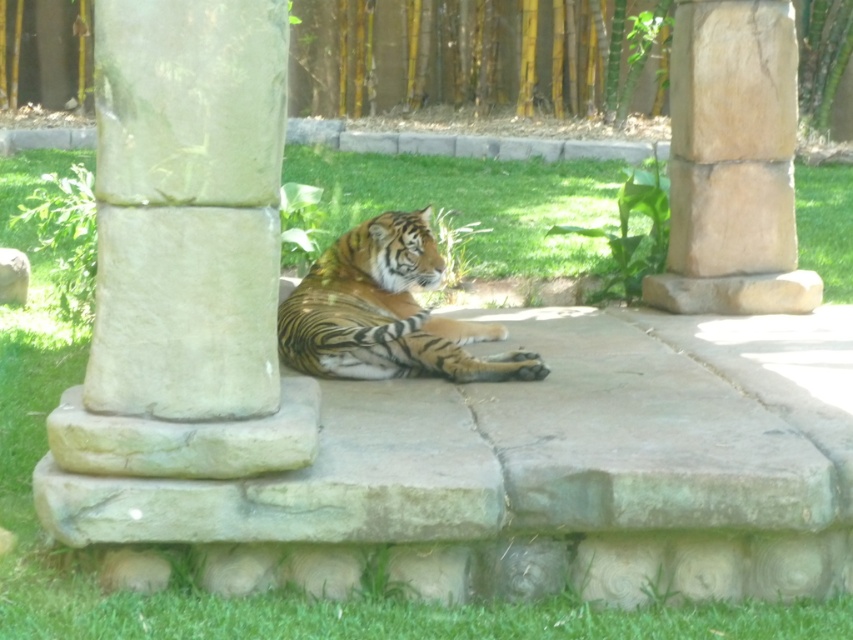
Can you confirm if smooth stone pillar at center is wider than natural stone pillar at center?

Incorrect, smooth stone pillar at center's width does not surpass natural stone pillar at center's.

Is smooth stone pillar at center positioned at the back of natural stone pillar at center?

No.

What are the coordinates of `smooth stone pillar at center` in the screenshot? It's located at (187, 208).

Between smooth stone pillar at center and smooth beige stone at lower left, which one has less height?

smooth beige stone at lower left is shorter.

The image size is (853, 640). Find the location of `smooth stone pillar at center`. smooth stone pillar at center is located at coordinates (187, 208).

Locate an element on the screen. The image size is (853, 640). smooth stone pillar at center is located at coordinates (187, 208).

Is smooth stone pillar at center positioned before orange-yellow tiger at center?

Yes, smooth stone pillar at center is in front of orange-yellow tiger at center.

Is point (219, 326) closer to camera compared to point (340, 371)?

Yes, point (219, 326) is closer to viewer.

Where is `smooth stone pillar at center`? The height and width of the screenshot is (640, 853). smooth stone pillar at center is located at coordinates (187, 208).